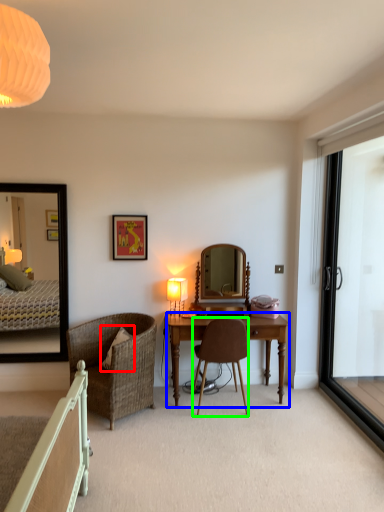
Question: Which object is positioned farthest from pillow (highlighted by a red box)? Select from desk (highlighted by a blue box) and chair (highlighted by a green box).

Choices:
 (A) desk
 (B) chair

Answer: (A)